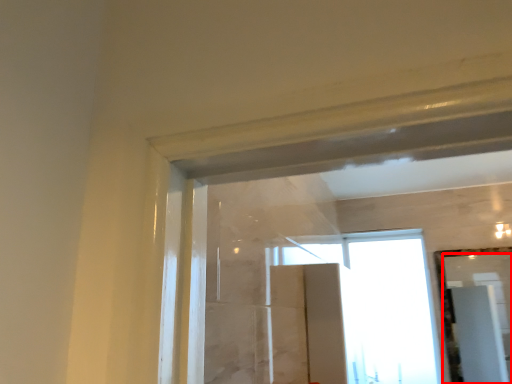
Question: From the image, what is the correct spatial relationship of mirror (annotated by the red box) in relation to window?

Choices:
 (A) right
 (B) left

Answer: (A)